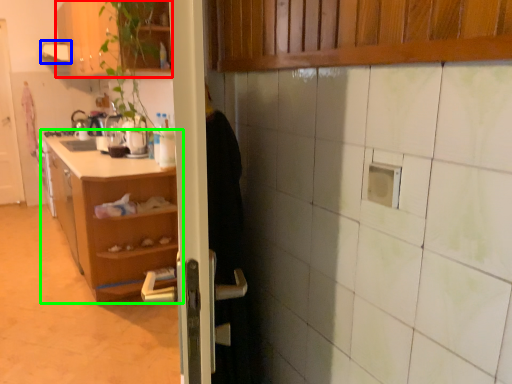
Question: Which object is the farthest from cabinetry (highlighted by a red box)? Choose among these: exhaust hood (highlighted by a blue box) or shelf (highlighted by a green box).

Choices:
 (A) exhaust hood
 (B) shelf

Answer: (B)